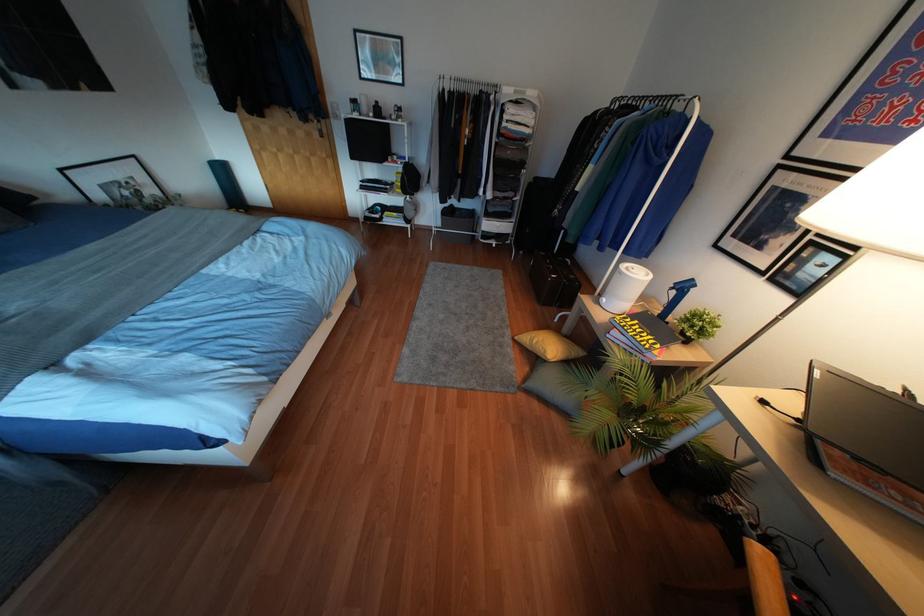
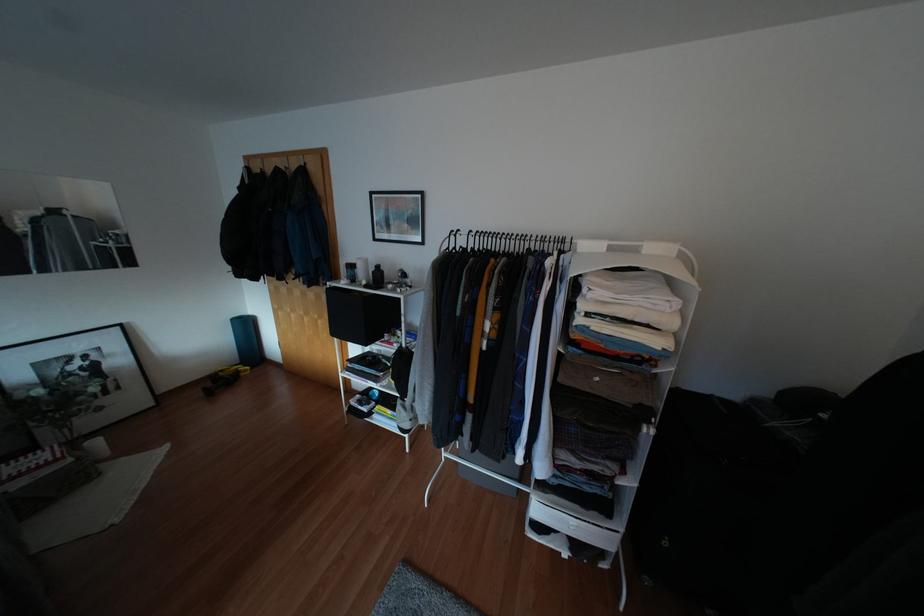
Question: I am providing you with two images of the same scene from different viewpoints. Which of the following objects are not visible in image2?

Choices:
 (A) yellow drill handle
 (B) black bottle
 (C) black clothes hanger
 (D) none of these

Answer: (D)